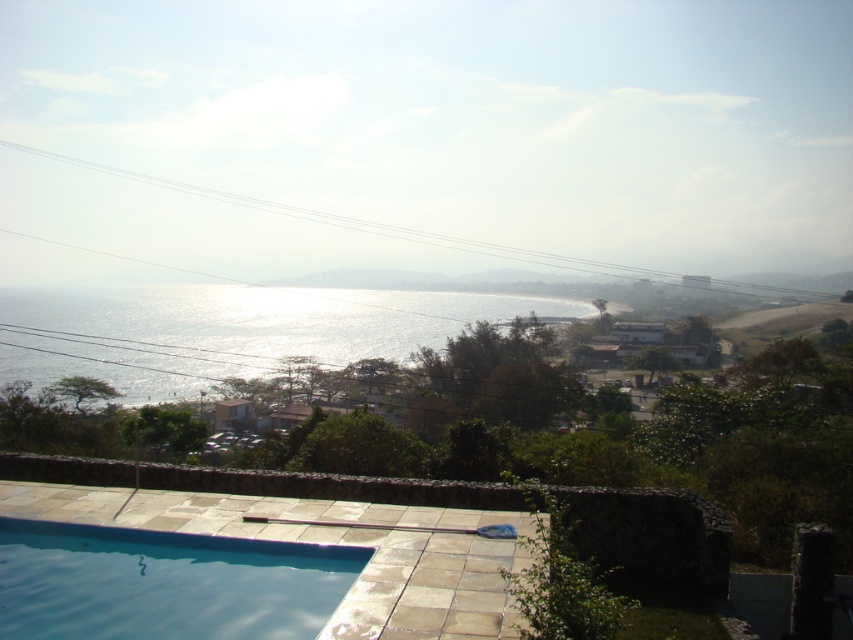
Who is taller, shiny metallic water at center or clear glass pool at lower left?

shiny metallic water at center

Is shiny metallic water at center bigger than clear glass pool at lower left?

Correct, shiny metallic water at center is larger in size than clear glass pool at lower left.

Image resolution: width=853 pixels, height=640 pixels. What do you see at coordinates (229, 330) in the screenshot? I see `shiny metallic water at center` at bounding box center [229, 330].

Where is `shiny metallic water at center`? The width and height of the screenshot is (853, 640). shiny metallic water at center is located at coordinates (229, 330).